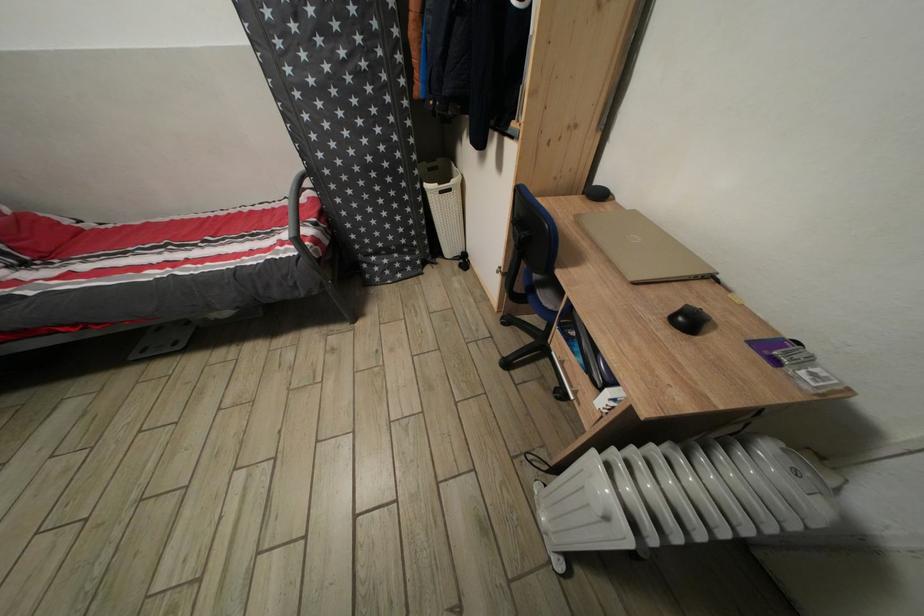
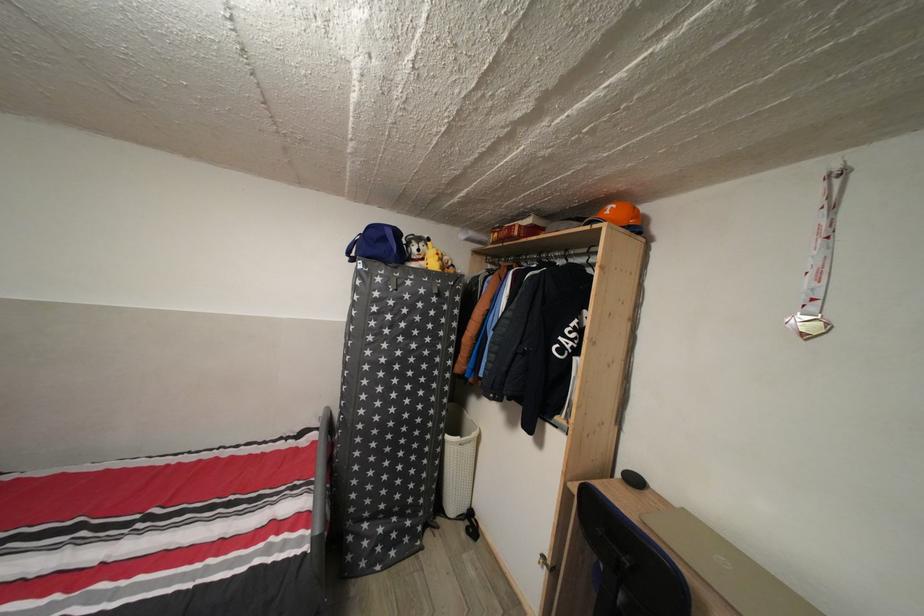
In the second image, find the point that corresponds to pixel 357 198 in the first image.

(380, 451)